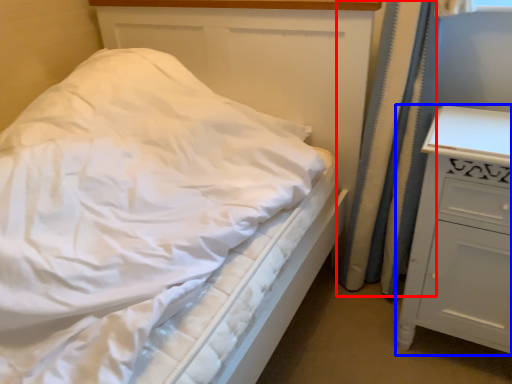
Question: Which of the following is the farthest to the observer, curtain (highlighted by a red box) or chest of drawers (highlighted by a blue box)?

Choices:
 (A) curtain
 (B) chest of drawers

Answer: (A)